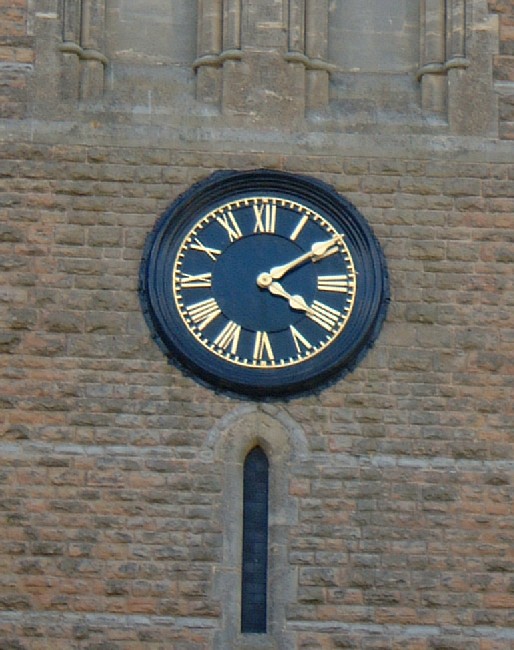
The image size is (514, 650). I want to click on wall, so click(356, 474).